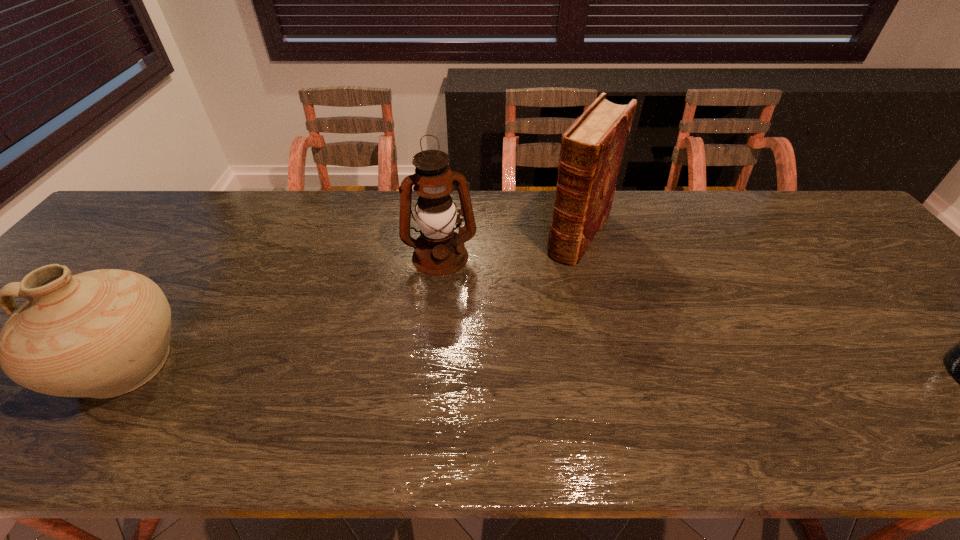
Where is `free region located on the spine side of the hardback book`? free region located on the spine side of the hardback book is located at coordinates (495, 369).

Locate an element on the screen. Image resolution: width=960 pixels, height=540 pixels. object that is at the far edge is located at coordinates (592, 148).

I want to click on object that is positioned at the near edge, so click(103, 333).

The width and height of the screenshot is (960, 540). What are the coordinates of `vacant space at the far edge of the desktop` in the screenshot? It's located at (739, 231).

This screenshot has width=960, height=540. What are the coordinates of `free point at the near edge` in the screenshot? It's located at (914, 390).

The height and width of the screenshot is (540, 960). In the image, there is a desktop. In order to click on free space at the right edge in this screenshot , I will do `click(825, 252)`.

This screenshot has width=960, height=540. Find the location of `vacant region at the far left corner of the desktop`. vacant region at the far left corner of the desktop is located at coordinates (144, 224).

This screenshot has height=540, width=960. I want to click on vacant region at the far right corner, so click(x=821, y=223).

Identify the location of free space between the pottery and the hardback book. (351, 298).

Find the location of a particular element. The height and width of the screenshot is (540, 960). free space between the third object from left to right and the third tallest object is located at coordinates (351, 298).